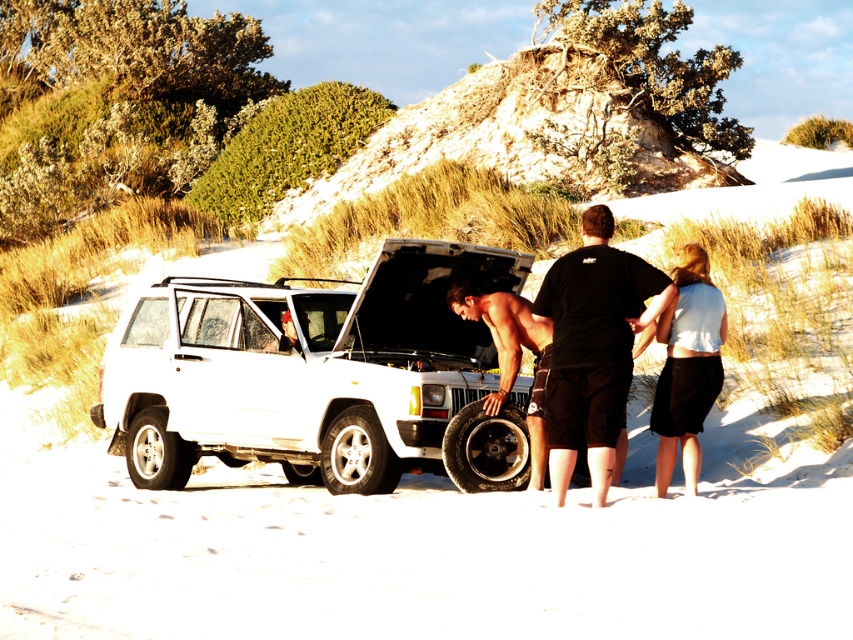
In the scene shown: Is black matte shirt at center to the left of white matte skirt at lower right from the viewer's perspective?

Correct, you'll find black matte shirt at center to the left of white matte skirt at lower right.

Is point (561, 269) more distant than point (674, 406)?

No, it is not.

You are a GUI agent. You are given a task and a screenshot of the screen. Output one action in this format:
    pyautogui.click(x=<x>, y=<y>)
    Task: Click on the black matte shirt at center
    This screenshot has height=640, width=853.
    Given the screenshot: What is the action you would take?
    pyautogui.click(x=592, y=346)

Does white matte suv at center appear over white matte skirt at lower right?

Incorrect, white matte suv at center is not positioned above white matte skirt at lower right.

Is white matte suv at center closer to the viewer compared to white matte skirt at lower right?

No, white matte suv at center is behind white matte skirt at lower right.

Describe the element at coordinates (318, 376) in the screenshot. I see `white matte suv at center` at that location.

In order to click on white matte suv at center in this screenshot , I will do `click(318, 376)`.

Between white matte suv at center and black matte shirt at center, which one has less height?

black matte shirt at center is shorter.

Which is behind, point (242, 436) or point (596, 298)?

Positioned behind is point (242, 436).

Does point (178, 289) lie behind point (550, 301)?

Yes, it is behind point (550, 301).

Find the location of `white matte suv at center`. white matte suv at center is located at coordinates (318, 376).